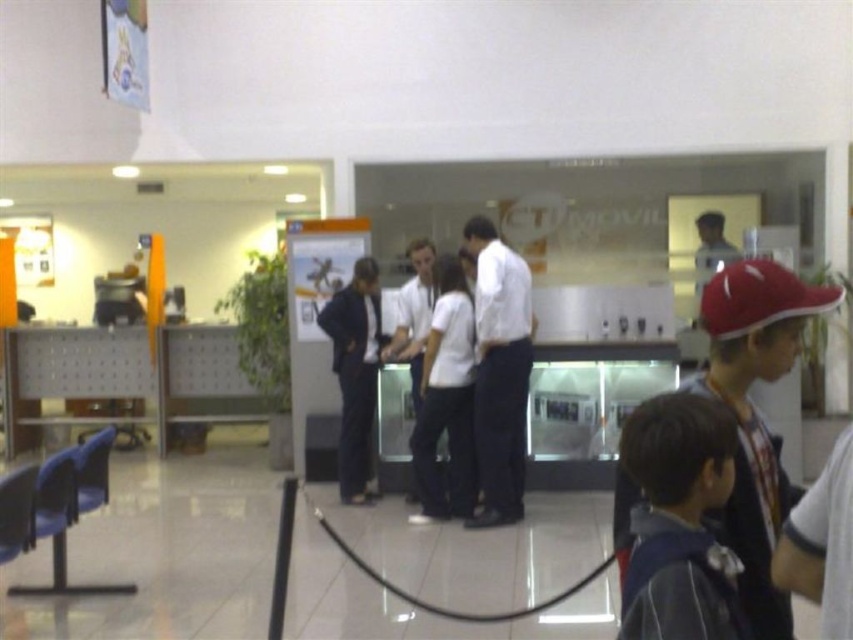
Question: Among these points, which one is nearest to the camera?

Choices:
 (A) tap(445, 317)
 (B) tap(502, 458)
 (C) tap(373, 344)

Answer: (B)

Question: Is white shirt at center to the left of white cotton shirt at center from the viewer's perspective?

Choices:
 (A) yes
 (B) no

Answer: (B)

Question: Among these objects, which one is nearest to the camera?

Choices:
 (A) white cotton shirt at center
 (B) white shirt at center
 (C) dark blue suit at center

Answer: (B)

Question: Which object appears farthest from the camera in this image?

Choices:
 (A) white shirt at center
 (B) white cotton shirt at center
 (C) dark blue suit at center

Answer: (C)

Question: In this image, where is white shirt at center located relative to dark blue suit at center?

Choices:
 (A) left
 (B) right

Answer: (B)

Question: Can you confirm if white cotton shirt at center is smaller than dark blue suit at center?

Choices:
 (A) yes
 (B) no

Answer: (B)